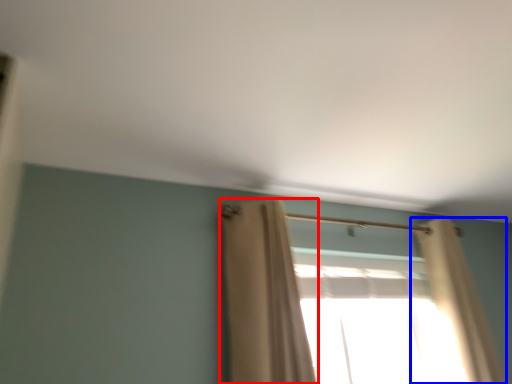
Question: Which of the following is the farthest to the observer, curtain (highlighted by a red box) or curtain (highlighted by a blue box)?

Choices:
 (A) curtain
 (B) curtain

Answer: (B)